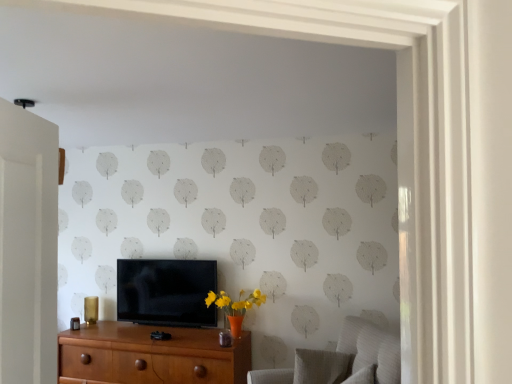
Question: Based on their sizes in the image, would you say textured gray swivel chair at lower right, which ranks as the 2th swivel chair in front-to-back order, is bigger or smaller than textured gray swivel chair at lower right, marked as the second swivel chair in a back-to-front arrangement?

Choices:
 (A) big
 (B) small

Answer: (B)

Question: Do you think textured gray swivel chair at lower right, the 1th swivel chair when ordered from back to front, is within textured gray swivel chair at lower right, the first swivel chair viewed from the front, or outside of it?

Choices:
 (A) inside
 (B) outside

Answer: (A)

Question: Which of these objects is positioned farthest from the brown wood chest of drawers at lower center?

Choices:
 (A) textured gray swivel chair at lower right, marked as the second swivel chair in a back-to-front arrangement
 (B) textured gray swivel chair at lower right, which ranks as the 2th swivel chair in front-to-back order
 (C) matte black tv at center

Answer: (A)

Question: Considering the real-world distances, which object is farthest from the matte black tv at center?

Choices:
 (A) textured gray swivel chair at lower right, which ranks as the 2th swivel chair in front-to-back order
 (B) textured gray swivel chair at lower right, the first swivel chair viewed from the front
 (C) brown wood chest of drawers at lower center

Answer: (B)